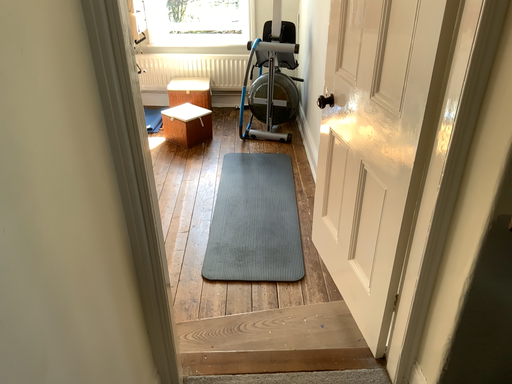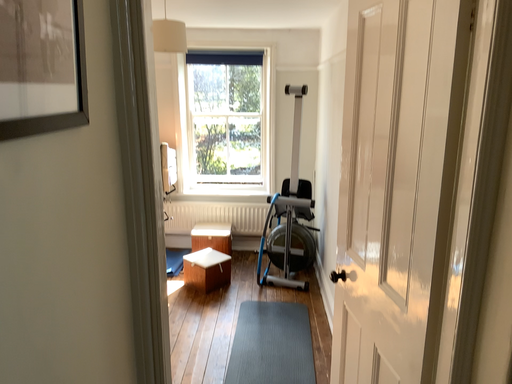
Question: How did the camera likely rotate when shooting the video?

Choices:
 (A) rotated downward
 (B) rotated upward

Answer: (B)